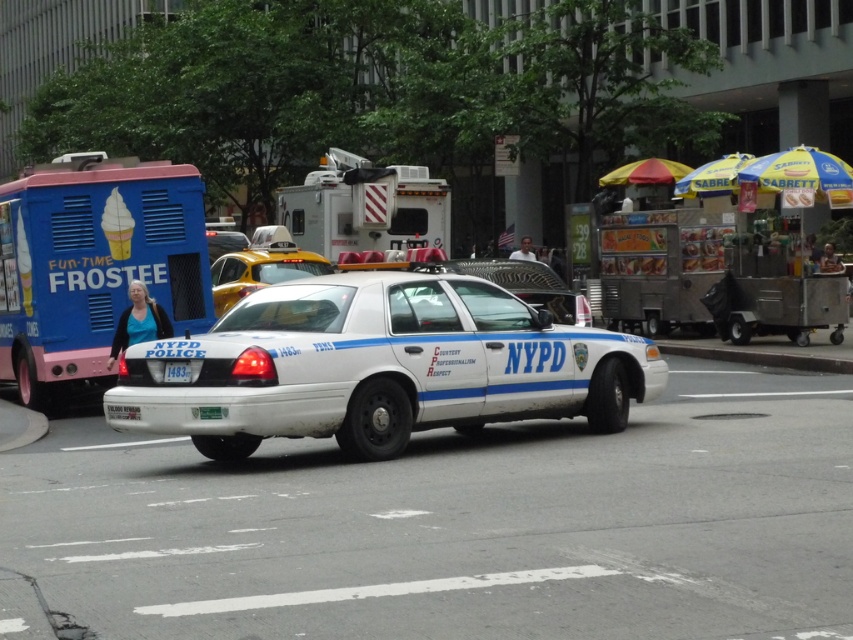
Question: Can you confirm if white glossy police car at center is positioned below white plastic food truck at center?

Choices:
 (A) yes
 (B) no

Answer: (A)

Question: Estimate the real-world distances between objects in this image. Which object is closer to the white glossy police car at center?

Choices:
 (A) blue painted ice cream truck at left
 (B) white plastic license plate at center
 (C) yellowsmoothtaxi at center
 (D) white plastic food truck at center

Answer: (B)

Question: Which point is closer to the camera?

Choices:
 (A) (201, 330)
 (B) (440, 305)
 (C) (247, 269)

Answer: (B)

Question: Does white plastic food truck at center appear over yellowsmoothtaxi at center?

Choices:
 (A) no
 (B) yes

Answer: (B)

Question: Among these objects, which one is nearest to the camera?

Choices:
 (A) blue painted ice cream truck at left
 (B) white plastic food truck at center
 (C) yellowsmoothtaxi at center

Answer: (A)

Question: Considering the relative positions of yellowsmoothtaxi at center and white plastic license plate at center in the image provided, where is yellowsmoothtaxi at center located with respect to white plastic license plate at center?

Choices:
 (A) right
 (B) left

Answer: (B)